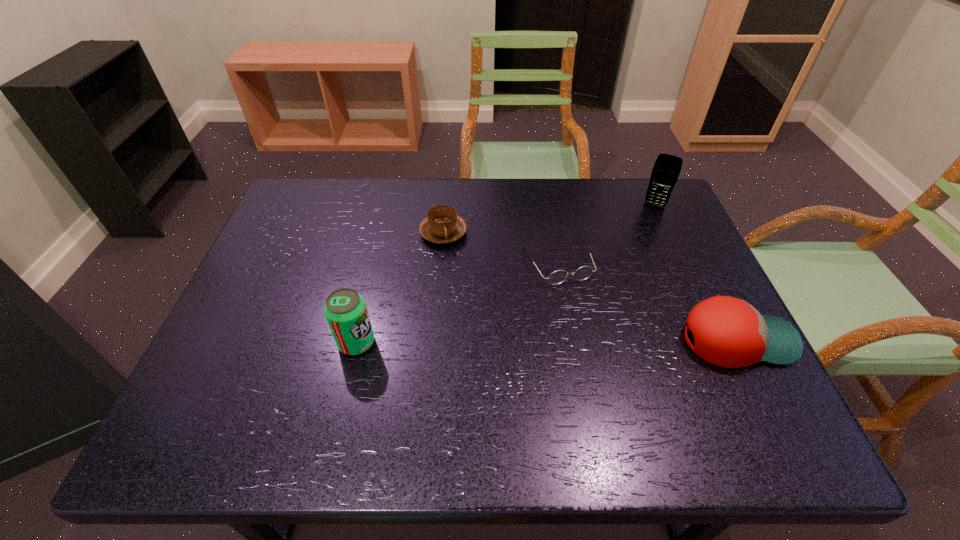
You are a GUI agent. You are given a task and a screenshot of the screen. Output one action in this format:
    pyautogui.click(x=<x>, y=<y>)
    Task: Click on the vacant space located 0.300m on the side of the second object from left to right with the handle
    
    Given the screenshot: What is the action you would take?
    pyautogui.click(x=518, y=318)

Image resolution: width=960 pixels, height=540 pixels. I want to click on free space located 0.230m on the side of the second object from left to right with the handle, so click(x=502, y=299).

The image size is (960, 540). Find the location of `vacant space located on the screen of the cellular telephone`. vacant space located on the screen of the cellular telephone is located at coordinates (646, 225).

The width and height of the screenshot is (960, 540). What are the coordinates of `vacant space located on the screen of the cellular telephone` in the screenshot? It's located at (620, 293).

What are the coordinates of `free space located on the screen of the cellular telephone` in the screenshot? It's located at (646, 225).

I want to click on free space located through the lenses of the shortest object, so click(x=595, y=340).

At what (x,y) coordinates should I click in order to perform the action: click on free region located through the lenses of the shortest object. Please return your answer as a coordinate pair (x, y). Looking at the image, I should click on (604, 358).

You are a GUI agent. You are given a task and a screenshot of the screen. Output one action in this format:
    pyautogui.click(x=<x>, y=<y>)
    Task: Click on the vacant space situated 0.250m through the lenses of the shortest object
    The width and height of the screenshot is (960, 540).
    Given the screenshot: What is the action you would take?
    pyautogui.click(x=610, y=369)

At what (x,y) coordinates should I click in order to perform the action: click on cappuccino located in the far edge section of the desktop. Please return your answer as a coordinate pair (x, y). This screenshot has height=540, width=960. Looking at the image, I should click on (442, 225).

Find the location of a particular element. This screenshot has width=960, height=540. cellular telephone that is positioned at the far edge is located at coordinates (666, 170).